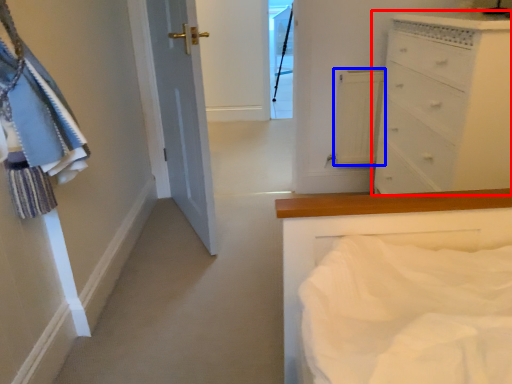
Question: Which of the following is the closest to the observer, chest of drawers (highlighted by a red box) or cabinetry (highlighted by a blue box)?

Choices:
 (A) chest of drawers
 (B) cabinetry

Answer: (A)